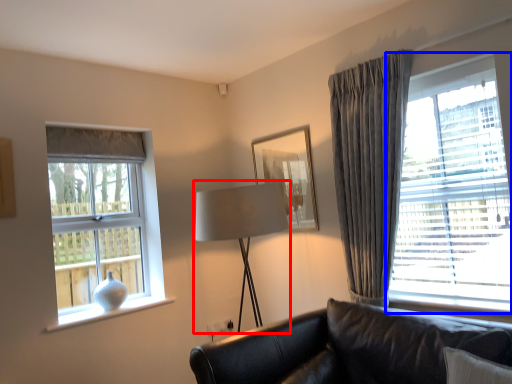
Question: Which point is further to the camera, table lamp (highlighted by a red box) or window (highlighted by a blue box)?

Choices:
 (A) table lamp
 (B) window

Answer: (A)